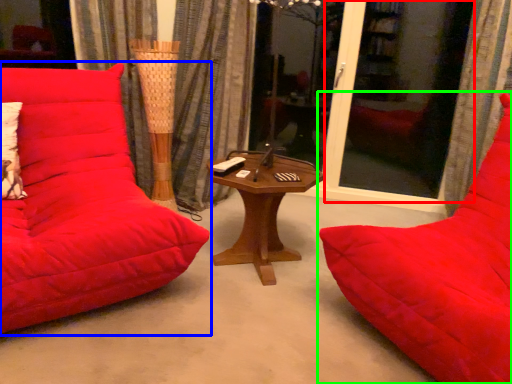
Question: Which object is the farthest from screen door (highlighted by a red box)? Choose among these: studio couch (highlighted by a blue box) or studio couch (highlighted by a green box).

Choices:
 (A) studio couch
 (B) studio couch

Answer: (A)